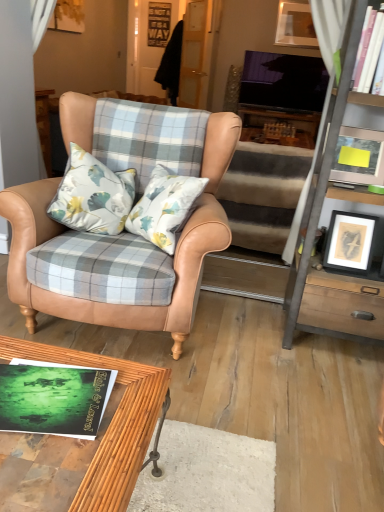
I want to click on free space to the left of metallic gray cabinet at right, so click(261, 338).